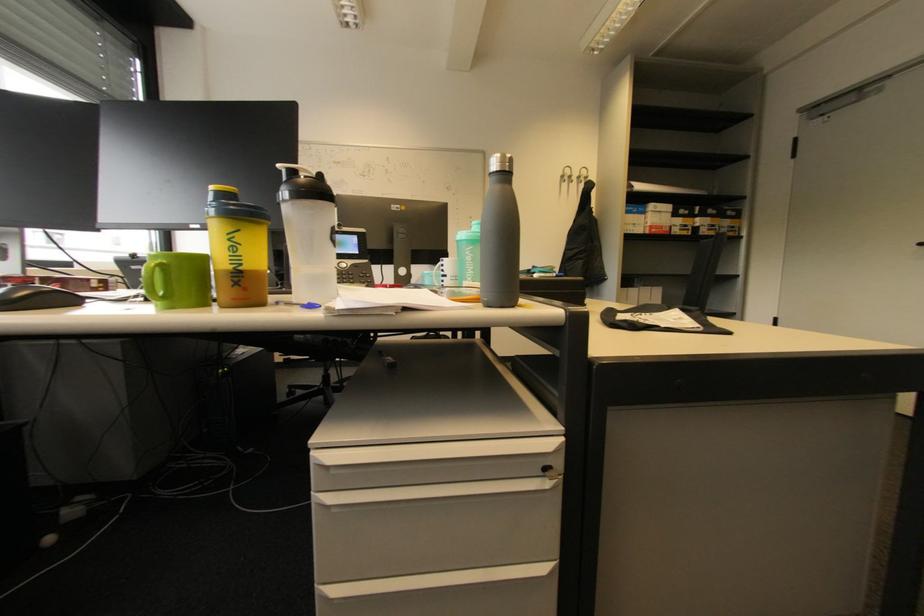
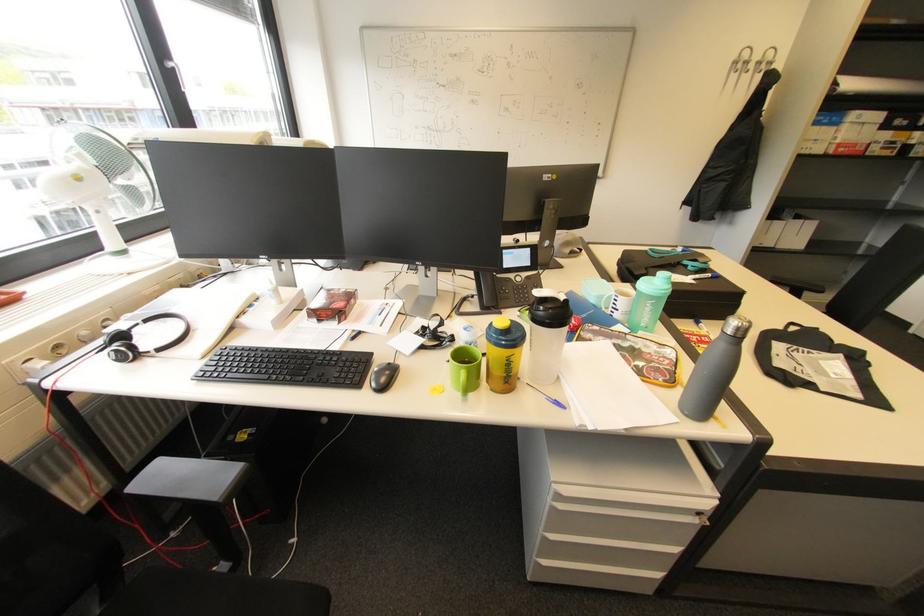
Locate, in the second image, the point that corresponds to (x=589, y=172) in the first image.

(775, 55)